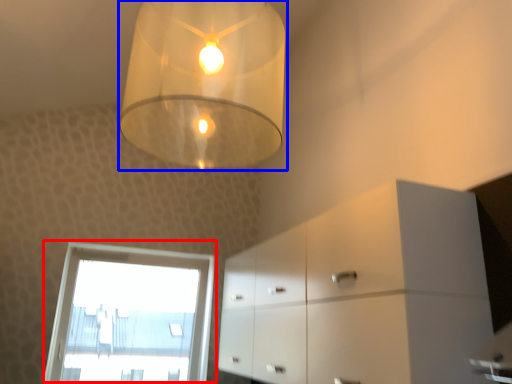
Question: Among these objects, which one is nearest to the camera, window (highlighted by a red box) or lamp (highlighted by a blue box)?

Choices:
 (A) window
 (B) lamp

Answer: (B)